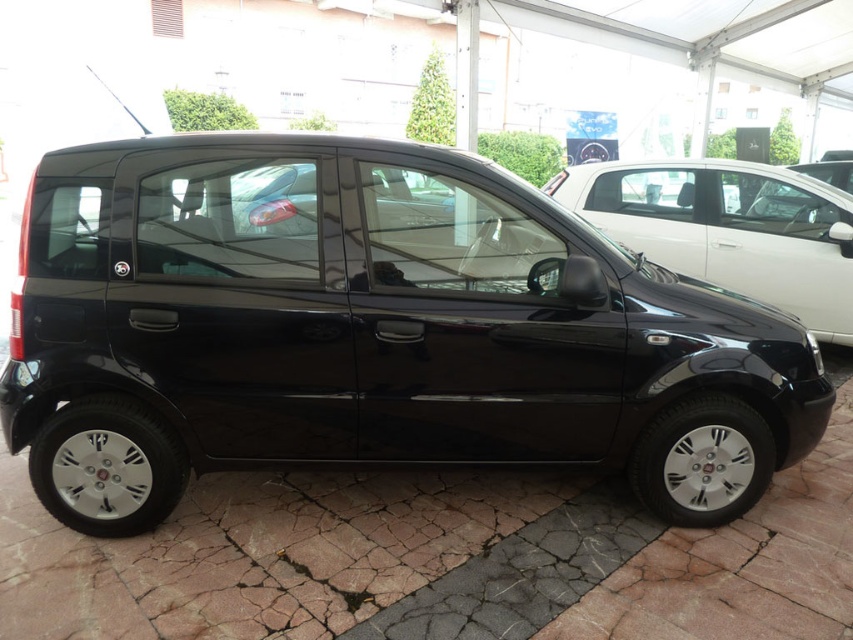
You are a delivery person trying to park a new glossy black minivan at center in the parking lot. There is a glossy black car at center already parked there. Can the minivan fit in the parking space if the car is 4.5 meters long and the parking space is 5 meters long?

The glossy black minivan at center has a smaller size compared to the glossy black car at center. Since the car is 4.5 meters long and the parking space is 5 meters long, the minivan would require less space, so it should fit comfortably within the 5 meter parking space.

You are standing at the entrance of the car dealership and see two points marked on the ground. The first point is at coordinate point (173,250) and the second is at point (677,196). Which point is nearer to you?

Point (173,250) is closer to the viewer than point (677,196).